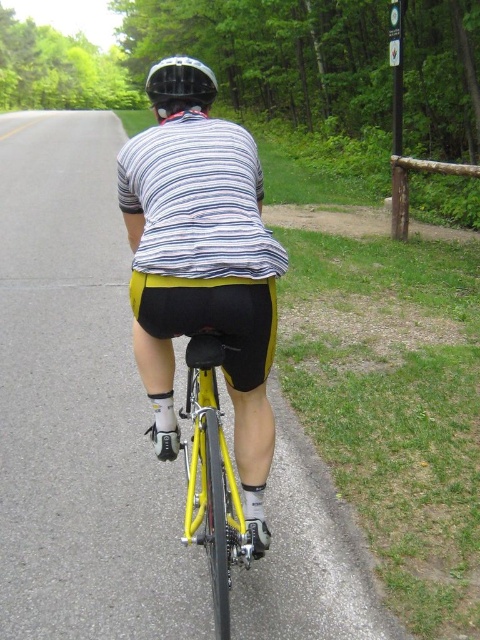
Question: Where is yellow matte bicycle at center located in relation to matte black helmet at upper center in the image?

Choices:
 (A) left
 (B) right

Answer: (B)

Question: Which point is farther from the camera taking this photo?

Choices:
 (A) (168, 93)
 (B) (228, 548)

Answer: (A)

Question: Among these objects, which one is nearest to the camera?

Choices:
 (A) matte black helmet at upper center
 (B) yellow matte bicycle at center

Answer: (B)

Question: Considering the relative positions of yellow matte bicycle at center and matte black helmet at upper center in the image provided, where is yellow matte bicycle at center located with respect to matte black helmet at upper center?

Choices:
 (A) above
 (B) below

Answer: (B)

Question: Can you confirm if yellow matte bicycle at center is wider than matte black helmet at upper center?

Choices:
 (A) no
 (B) yes

Answer: (A)

Question: Which of the following is the farthest from the observer?

Choices:
 (A) (168, 90)
 (B) (229, 632)

Answer: (A)